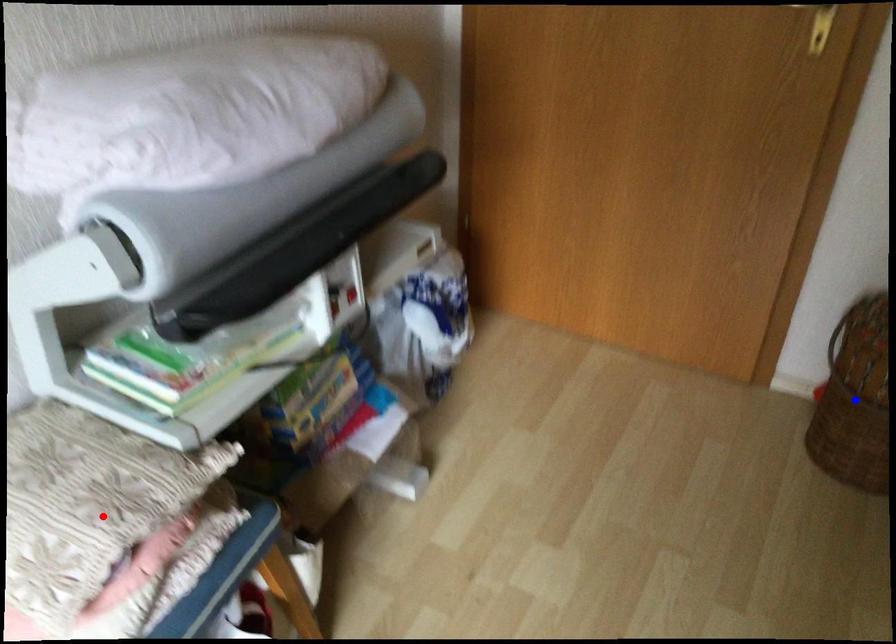
Question: In the image, two points are highlighted. Which point is nearer to the camera? Reply with the corresponding letter.

Choices:
 (A) blue point
 (B) red point

Answer: (B)